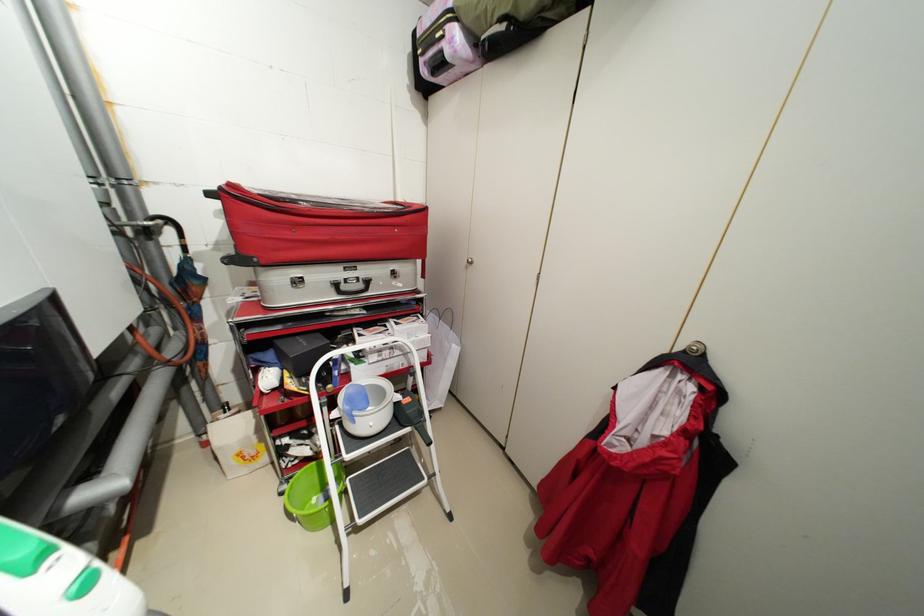
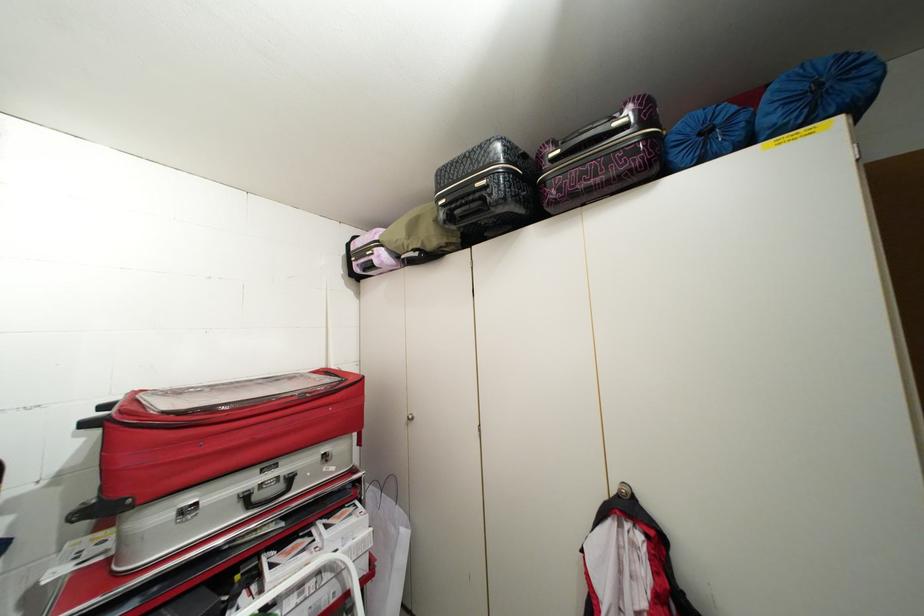
Where in the second image is the point corresponding to point (368, 286) from the first image?

(287, 487)